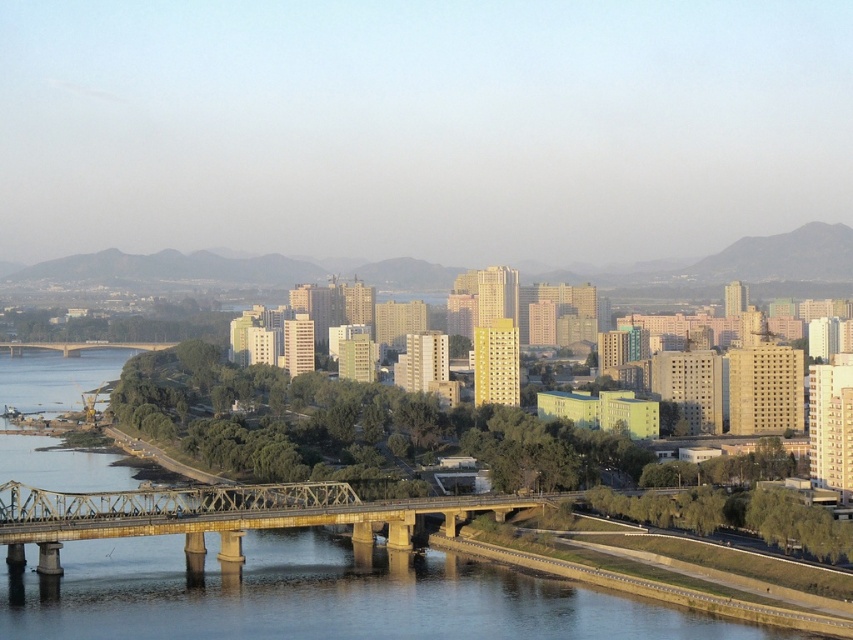
Is golden metallic bridge at center below brown metallic bridge at center?

Indeed, golden metallic bridge at center is positioned under brown metallic bridge at center.

Is golden metallic bridge at center behind brown metallic bridge at center?

No, it is in front of brown metallic bridge at center.

Is point (144, 509) closer to camera compared to point (19, 348)?

Yes, it is.

I want to click on golden metallic bridge at center, so click(216, 515).